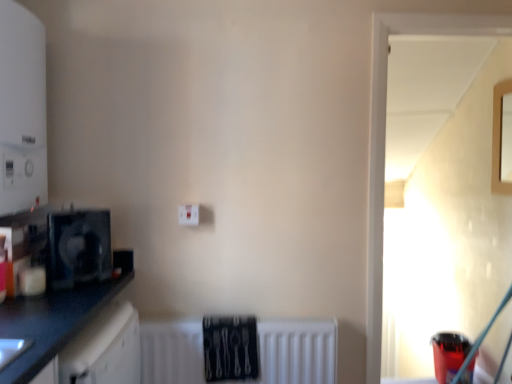
Question: From the image's perspective, is black plastic fan at left, which ranks as the 1th appliance in top-to-bottom order, over white matte radiator at lower center?

Choices:
 (A) no
 (B) yes

Answer: (B)

Question: Is white matte radiator at lower center at the back of black plastic fan at left, which is the second appliance from right to left?

Choices:
 (A) no
 (B) yes

Answer: (A)

Question: Can you confirm if black plastic fan at left, the 1th appliance in the front-to-back sequence, is taller than white matte radiator at lower center?

Choices:
 (A) no
 (B) yes

Answer: (A)

Question: From the image's perspective, would you say black plastic fan at left, the 2th appliance positioned from the bottom, is shown under white matte radiator at lower center?

Choices:
 (A) yes
 (B) no

Answer: (B)

Question: Does black plastic fan at left, arranged as the 2th appliance when viewed from the back, have a lesser height compared to white matte radiator at lower center?

Choices:
 (A) yes
 (B) no

Answer: (A)

Question: From a real-world perspective, relative to transparent glass door at upper right, the first window from the left, is black matte countertop at left vertically above or below?

Choices:
 (A) above
 (B) below

Answer: (B)

Question: Do you think black matte countertop at left is within transparent glass door at upper right, which is counted as the 2th window, starting from the right, or outside of it?

Choices:
 (A) outside
 (B) inside

Answer: (A)

Question: Considering the positions of black matte countertop at left and transparent glass door at upper right, placed as the 2th window when sorted from back to front, in the image, is black matte countertop at left bigger or smaller than transparent glass door at upper right, placed as the 2th window when sorted from back to front,?

Choices:
 (A) big
 (B) small

Answer: (A)

Question: Looking at their shapes, would you say black matte countertop at left is wider or thinner than transparent glass door at upper right, placed as the 2th window when sorted from back to front?

Choices:
 (A) thin
 (B) wide

Answer: (B)

Question: Is transparent glass door at upper right, arranged as the first window when viewed from the front, to the left or to the right of translucent plastic cup at lower right, which is the first appliance in bottom-to-top order, in the image?

Choices:
 (A) right
 (B) left

Answer: (B)

Question: Based on their sizes in the image, would you say transparent glass door at upper right, which is counted as the 2th window, starting from the right, is bigger or smaller than translucent plastic cup at lower right, acting as the 1th appliance starting from the back?

Choices:
 (A) small
 (B) big

Answer: (B)

Question: Is point (397, 16) positioned closer to the camera than point (445, 377)?

Choices:
 (A) closer
 (B) farther

Answer: (A)

Question: From a real-world perspective, is transparent glass door at upper right, the first window from the left, above or below translucent plastic cup at lower right, which ranks as the second appliance in front-to-back order?

Choices:
 (A) above
 (B) below

Answer: (A)

Question: Which is correct: wooden frame at upper right, marked as the 1th window in a right-to-left arrangement, is inside black matte countertop at left, or outside of it?

Choices:
 (A) outside
 (B) inside

Answer: (A)

Question: Considering the relative positions of wooden frame at upper right, which appears as the 2th window when viewed from the front, and black matte countertop at left in the image provided, is wooden frame at upper right, which appears as the 2th window when viewed from the front, to the left or to the right of black matte countertop at left?

Choices:
 (A) right
 (B) left

Answer: (A)